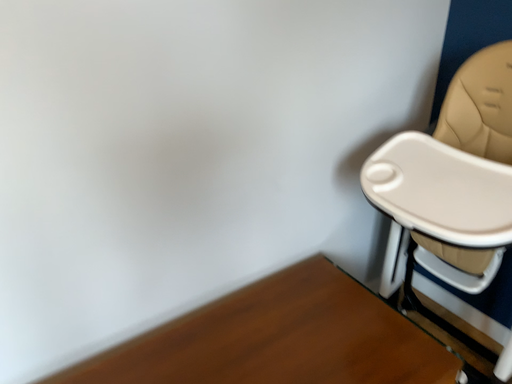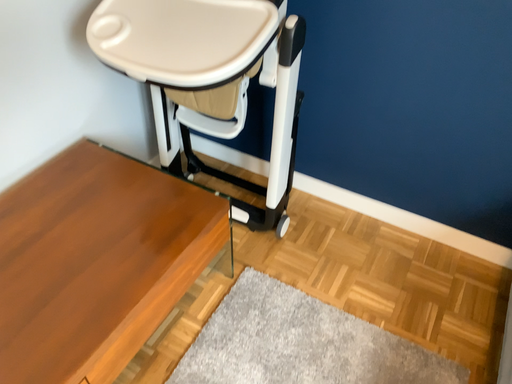
Question: How did the camera likely rotate when shooting the video?

Choices:
 (A) rotated upward
 (B) rotated downward

Answer: (B)